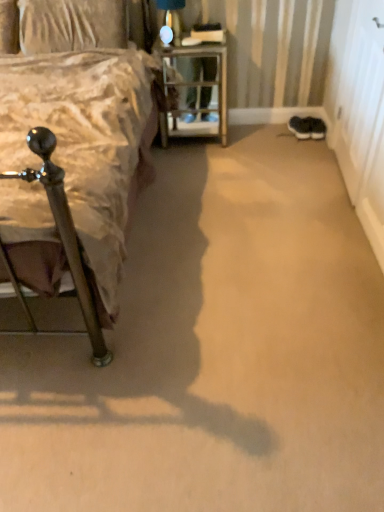
Locate an element on the screen. The image size is (384, 512). vacant space in front of black suede sneakers at lower right, the 1th footwear viewed from the left is located at coordinates (303, 143).